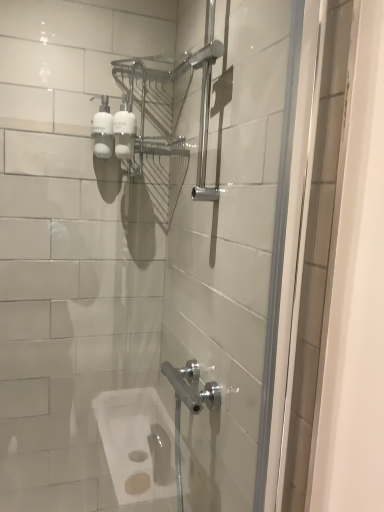
Question: Is white matte pump bottle at upper center, the 1th toiletry from the right, in front of white glossy pump bottles at upper left, the 2th toiletry viewed from the right?

Choices:
 (A) yes
 (B) no

Answer: (A)

Question: Is white matte pump bottle at upper center, the 1th toiletry from the right, outside white glossy pump bottles at upper left, the 2th toiletry viewed from the right?

Choices:
 (A) no
 (B) yes

Answer: (B)

Question: Does white matte pump bottle at upper center, the 1th toiletry from the right, have a lesser width compared to white glossy pump bottles at upper left, the 2th toiletry viewed from the right?

Choices:
 (A) no
 (B) yes

Answer: (A)

Question: Is white matte pump bottle at upper center, the 1th toiletry from the right, to the right of white glossy pump bottles at upper left, the 2th toiletry viewed from the right, from the viewer's perspective?

Choices:
 (A) yes
 (B) no

Answer: (A)

Question: Does white matte pump bottle at upper center, the 1th toiletry from the right, have a greater height compared to white glossy pump bottles at upper left, the 2th toiletry viewed from the right?

Choices:
 (A) no
 (B) yes

Answer: (A)

Question: Is white matte pump bottle at upper center, the 2th toiletry positioned from the left, placed right next to white glossy pump bottles at upper left, the 2th toiletry viewed from the right?

Choices:
 (A) yes
 (B) no

Answer: (A)

Question: Does white glossy pump bottles at upper left, the 1th toiletry from the left, appear on the right side of white matte pump bottle at upper center, the 2th toiletry positioned from the left?

Choices:
 (A) yes
 (B) no

Answer: (B)

Question: Considering the relative sizes of white glossy pump bottles at upper left, the 1th toiletry from the left, and white matte pump bottle at upper center, the 2th toiletry positioned from the left, in the image provided, is white glossy pump bottles at upper left, the 1th toiletry from the left, bigger than white matte pump bottle at upper center, the 2th toiletry positioned from the left,?

Choices:
 (A) no
 (B) yes

Answer: (B)

Question: Can you confirm if white glossy pump bottles at upper left, the 2th toiletry viewed from the right, is taller than white matte pump bottle at upper center, the 2th toiletry positioned from the left?

Choices:
 (A) no
 (B) yes

Answer: (B)

Question: From the image's perspective, would you say white glossy pump bottles at upper left, the 1th toiletry from the left, is positioned over white matte pump bottle at upper center, the 2th toiletry positioned from the left?

Choices:
 (A) no
 (B) yes

Answer: (B)

Question: Is white glossy pump bottles at upper left, the 2th toiletry viewed from the right, shorter than white matte pump bottle at upper center, the 2th toiletry positioned from the left?

Choices:
 (A) yes
 (B) no

Answer: (B)

Question: Can you confirm if white glossy pump bottles at upper left, the 2th toiletry viewed from the right, is wider than white matte pump bottle at upper center, the 2th toiletry positioned from the left?

Choices:
 (A) yes
 (B) no

Answer: (B)

Question: From a real-world perspective, is white glossy pump bottles at upper left, the 1th toiletry from the left, positioned above or below white matte pump bottle at upper center, the 2th toiletry positioned from the left?

Choices:
 (A) above
 (B) below

Answer: (A)